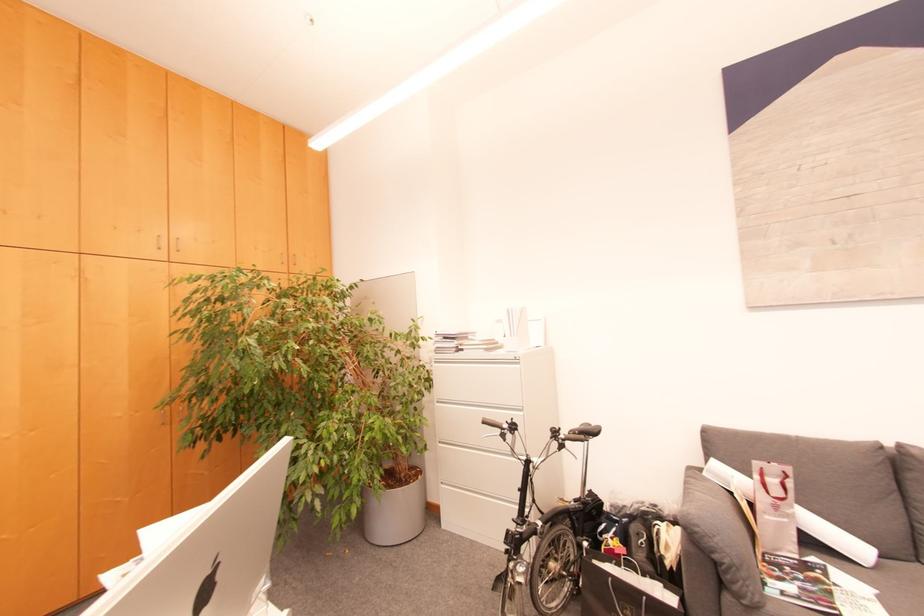
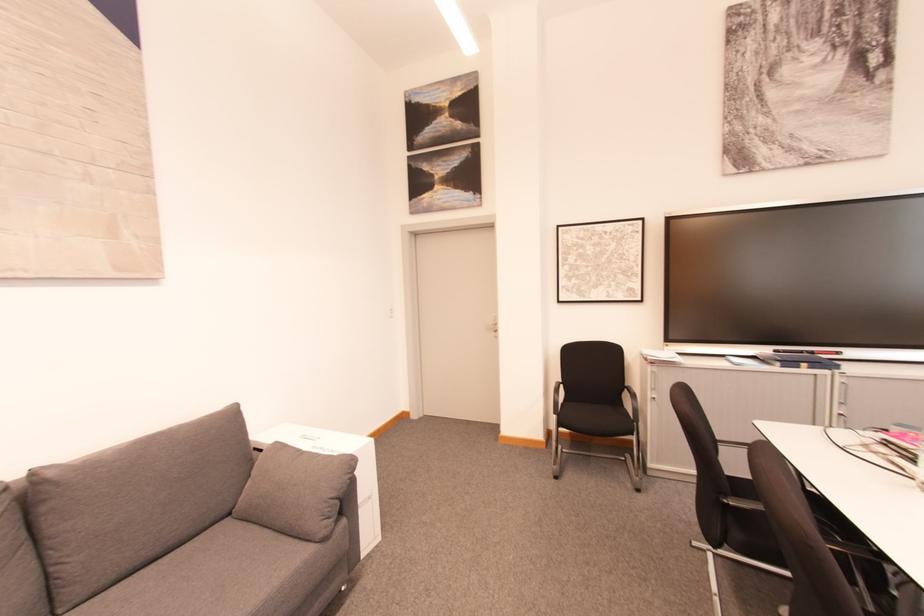
Question: How did the camera likely rotate?

Choices:
 (A) Left
 (B) Right
 (C) Up
 (D) Down

Answer: (B)